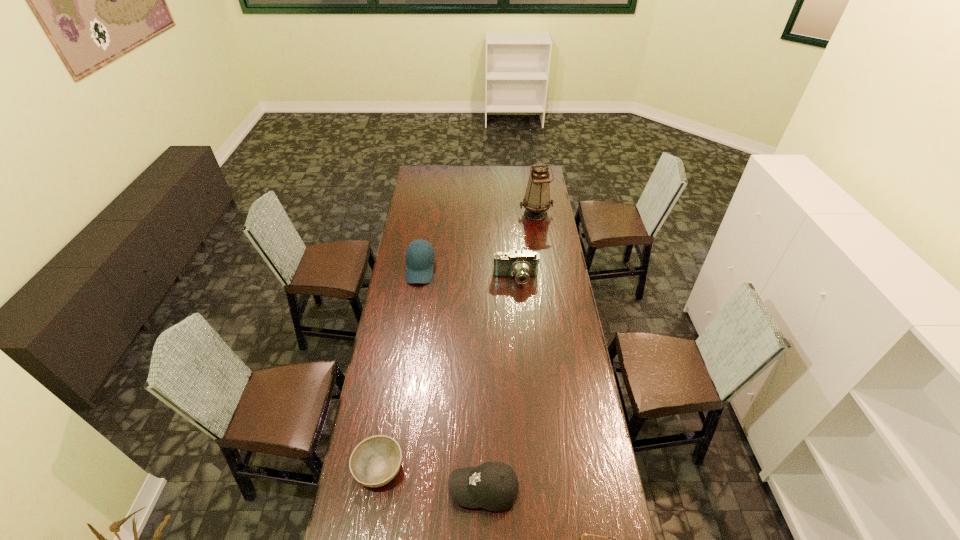
In order to click on free region at the left edge of the desktop in this screenshot , I will do `click(413, 359)`.

In the image, there is a desktop. Where is `free space at the right edge`? free space at the right edge is located at coordinates (595, 470).

Where is `vacant space at the far left corner`? vacant space at the far left corner is located at coordinates (x=414, y=175).

You are a GUI agent. You are given a task and a screenshot of the screen. Output one action in this format:
    pyautogui.click(x=<x>, y=<y>)
    Task: Click on the unoccupied position between the camcorder and the taller baseball cap
    This screenshot has width=960, height=540.
    Given the screenshot: What is the action you would take?
    pyautogui.click(x=468, y=274)

Locate an element on the screen. Image resolution: width=960 pixels, height=540 pixels. vacant area between the tallest object and the right baseball cap is located at coordinates (510, 352).

Where is `blank region between the camcorder and the oil lamp`? The width and height of the screenshot is (960, 540). blank region between the camcorder and the oil lamp is located at coordinates (x=526, y=246).

The height and width of the screenshot is (540, 960). I want to click on vacant area that lies between the oil lamp and the bowl, so click(x=457, y=341).

Where is `vacant region between the camcorder and the nearer baseball cap`? The height and width of the screenshot is (540, 960). vacant region between the camcorder and the nearer baseball cap is located at coordinates (500, 384).

Locate an element on the screen. This screenshot has height=540, width=960. empty space between the camcorder and the bowl is located at coordinates (447, 373).

You are a GUI agent. You are given a task and a screenshot of the screen. Output one action in this format:
    pyautogui.click(x=<x>, y=<y>)
    Task: Click on the vacant point located between the taller baseball cap and the bowl
    This screenshot has width=960, height=540.
    Given the screenshot: What is the action you would take?
    pyautogui.click(x=399, y=368)